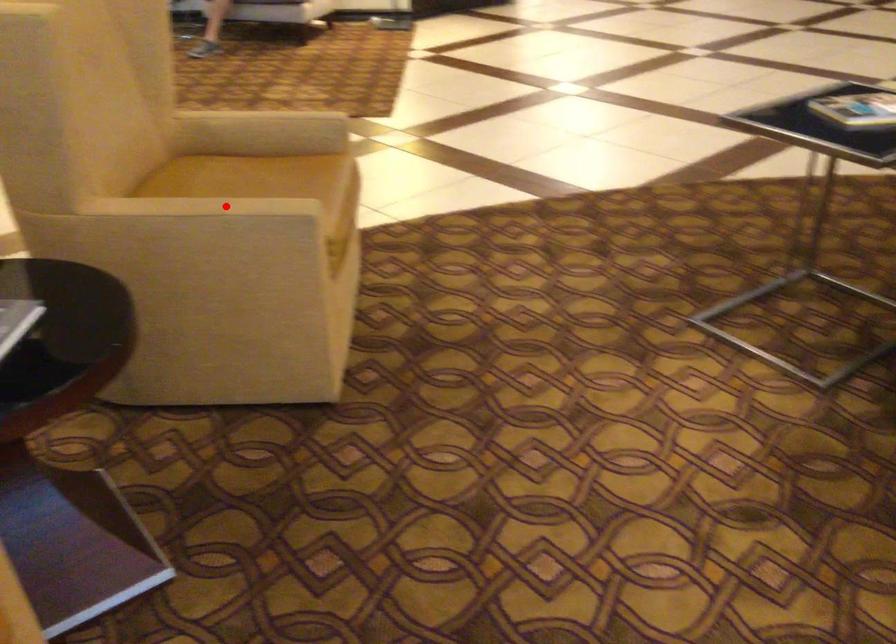
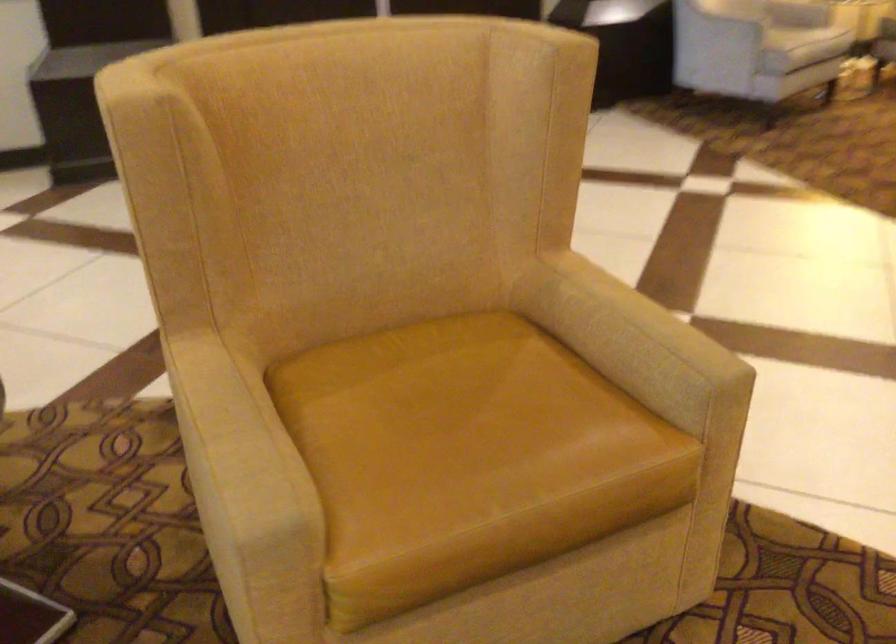
Question: I am providing you with two images of the same scene from different viewpoints. In image1, a red point is highlighted. Considering the same 3D point in image2, which of the following is correct?

Choices:
 (A) It is closer
 (B) It is farther

Answer: (A)